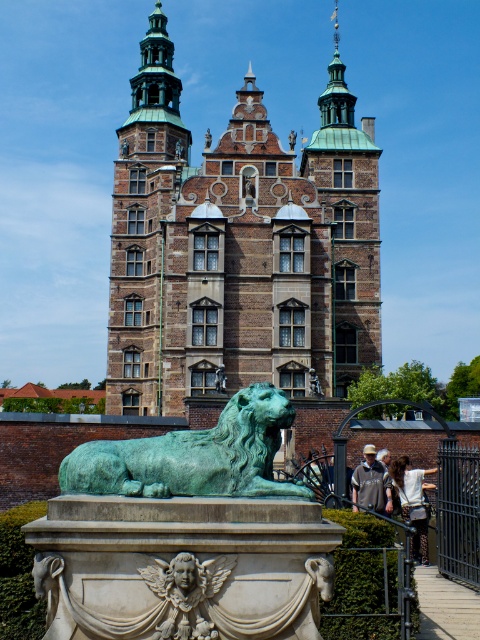
You are standing in front of the grand historic building and notice the green patina bronze lion at center and the light brown hair at lower right. Which object is closer to you, the observer?

The green patina bronze lion at center is closer to you because it is in front of the light brown hair at lower right.

You are a tourist standing at the base of the historic building. You see the gray fabric jacket at lower center and the green patina lion at center. How far apart are these two objects from each other?

The gray fabric jacket at lower center is 15.68 meters from the green patina lion at center.